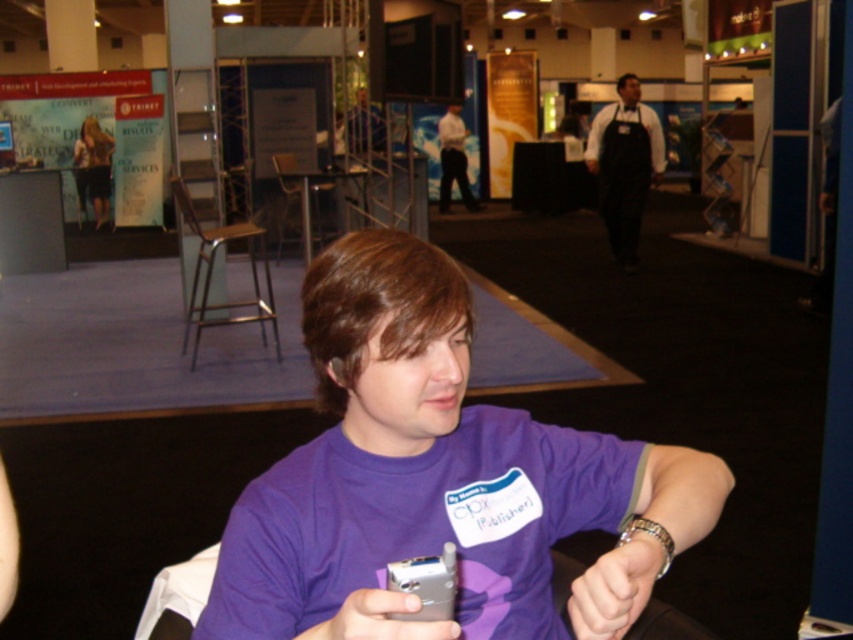
Question: Can you confirm if black apron at right is bigger than purple fabric wristband at lower center?

Choices:
 (A) yes
 (B) no

Answer: (A)

Question: Which of the following is the closest to the observer?

Choices:
 (A) white shirt at center
 (B) purple fabric wristband at lower center
 (C) black apron at right

Answer: (B)

Question: Is purple fabric shirt at center behind purple fabric wristband at lower center?

Choices:
 (A) yes
 (B) no

Answer: (B)

Question: Which point appears closest to the camera in this image?

Choices:
 (A) (590, 156)
 (B) (86, 150)
 (C) (412, 477)
 (D) (633, 582)

Answer: (D)

Question: Which of these objects is positioned farthest from the purple fabric wristband at lower center?

Choices:
 (A) purple fabric shirt at center
 (B) white shirt at center
 (C) matte black dress at upper left
 (D) black apron at right

Answer: (C)

Question: Is purple fabric shirt at center wider than matte black dress at upper left?

Choices:
 (A) no
 (B) yes

Answer: (A)